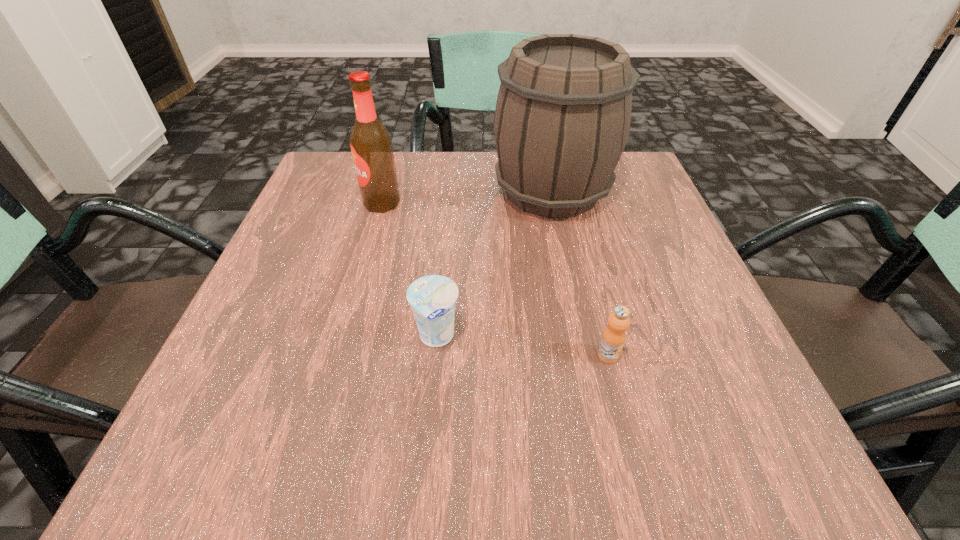
Locate an element on the screen. vacant point located between the orange juice and the wine bucket is located at coordinates (580, 273).

The width and height of the screenshot is (960, 540). I want to click on free space between the yogurt and the orange juice, so click(x=522, y=347).

Find the location of a particular element. object identified as the third closest to the orange juice is located at coordinates (371, 144).

Identify the location of object that is the third closest to the yogurt. Image resolution: width=960 pixels, height=540 pixels. (371, 144).

Where is `free space that satisfies the following two spatial constraints: 1. on the back side of the wine bucket; 2. on the right side of the yogurt`? This screenshot has height=540, width=960. free space that satisfies the following two spatial constraints: 1. on the back side of the wine bucket; 2. on the right side of the yogurt is located at coordinates click(449, 191).

Locate an element on the screen. vacant position in the image that satisfies the following two spatial constraints: 1. on the back side of the wine bucket; 2. on the right side of the yogurt is located at coordinates (449, 191).